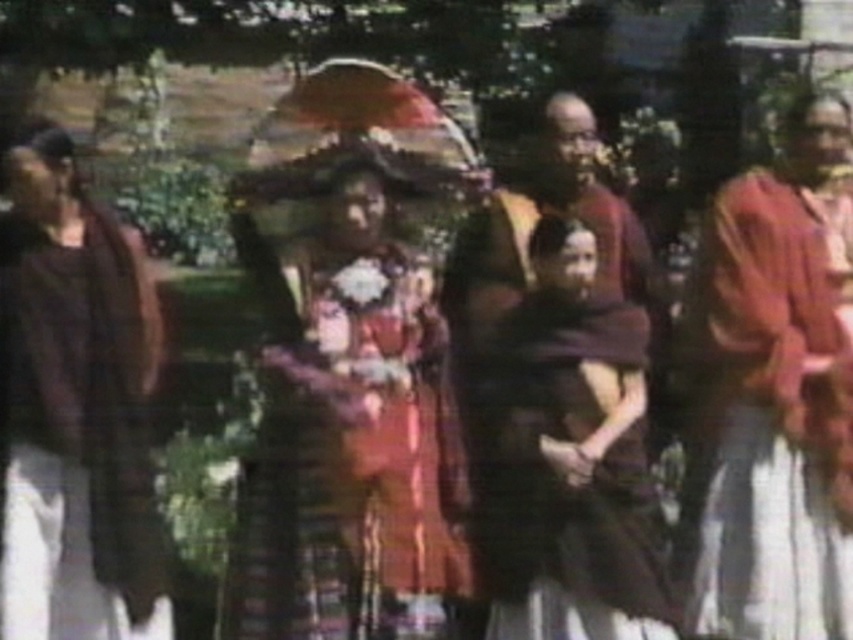
You are organizing a fashion show and need to decide the order of models based on their dress lengths. If the model wearing the silky pink dress at right walks first, will the next model wearing the matte brown dress at left need to step over the previous dress?

The silky pink dress at right is shorter than the matte brown dress at left. Since the first model has a shorter dress, the next model with the longer matte brown dress at left will not need to step over the previous dress as their dress is longer and won

You are organizing a cultural event and need to arrange seating based on the size of the attendees. Looking at the image, which of the two dresses, the textured fabric dress at center or the matte brown dress at left, belongs to a larger individual?

The textured fabric dress at center is bigger than the matte brown dress at left, so it belongs to a larger individual.

Looking at this image, you are organizing a fashion show and need to arrange the silky pink dress at right and the matte brown dress at left based on their sizes. Which dress should be placed first if you want to display them from smallest to largest?

The silky pink dress at right has a smaller size compared to matte brown dress at left, so it should be placed first in the display from smallest to largest.